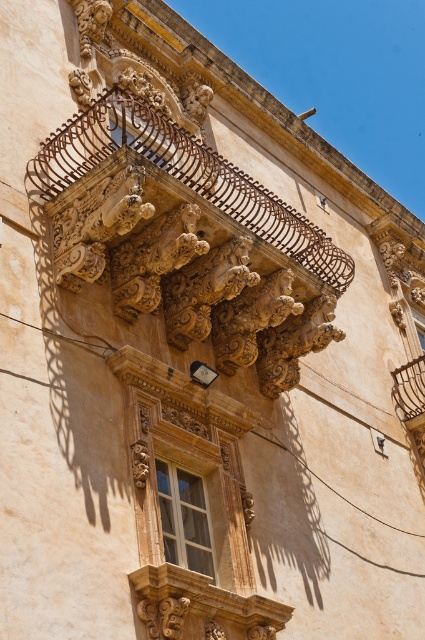
You are a window cleaner with a ladder that can reach up to 8 meters. You need to clean the matte wood window at center and the carved stone balcony at upper center. Can you safely reach both with your current ladder?

The distance between the carved stone balcony at upper center and the matte wood window at center is 9.07 meters. Since your ladder can only reach up to 8 meters, you cannot safely reach the carved stone balcony at upper center, but you can reach the matte wood window at center if it is within the ladder height limit.

You are an architect analyzing the building facade. You see a point marked at coordinates (184, 177). Based on the scene description, what architectural feature does this point most likely correspond to?

The point at (184, 177) corresponds to the carved stone balcony at upper center, as indicated by the description.

You are standing at the base of the building looking up at the carved stone balcony at upper center. If you want to reach the balcony, would you need to climb a ladder taller than 45 meters?

The carved stone balcony at upper center and viewer are 46.16 meters apart, so yes, you would need a ladder taller than 45 meters to reach it.